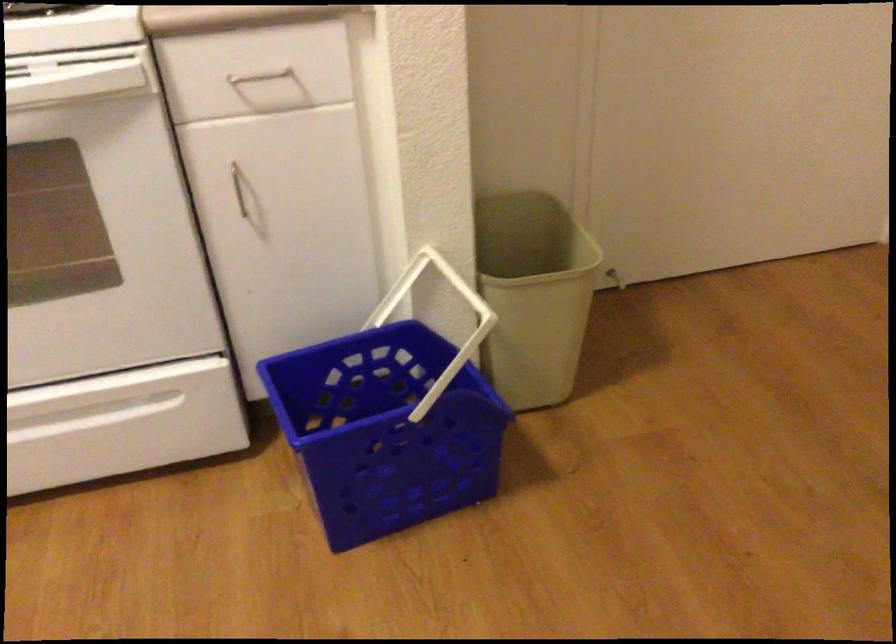
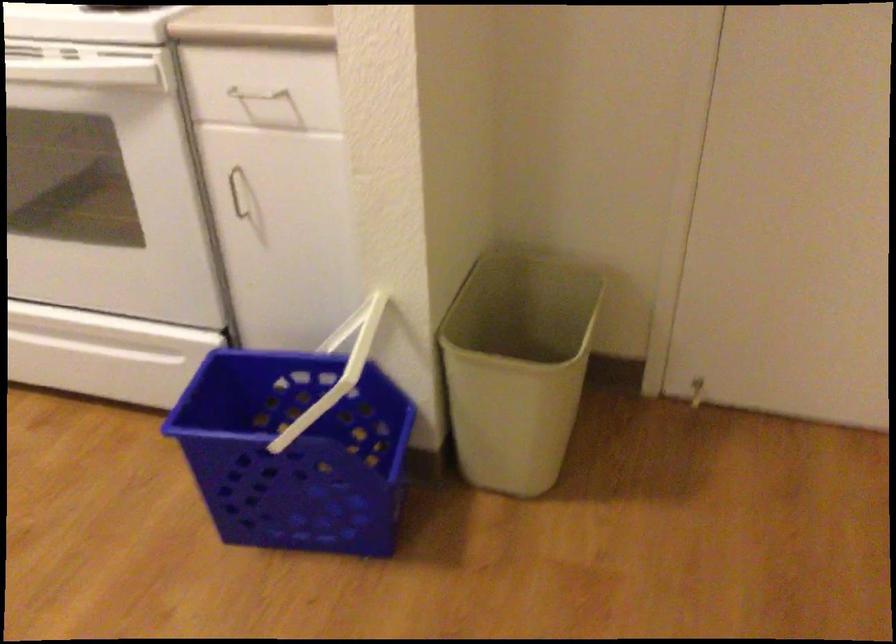
Locate, in the second image, the point that corresponds to point (564, 275) in the first image.

(517, 366)